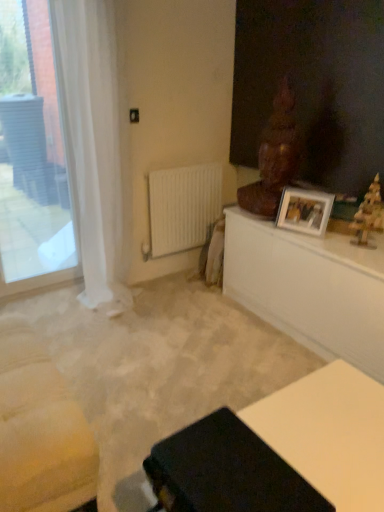
Locate an element on the screen. vacant region to the right of white sheer curtain at left is located at coordinates (172, 301).